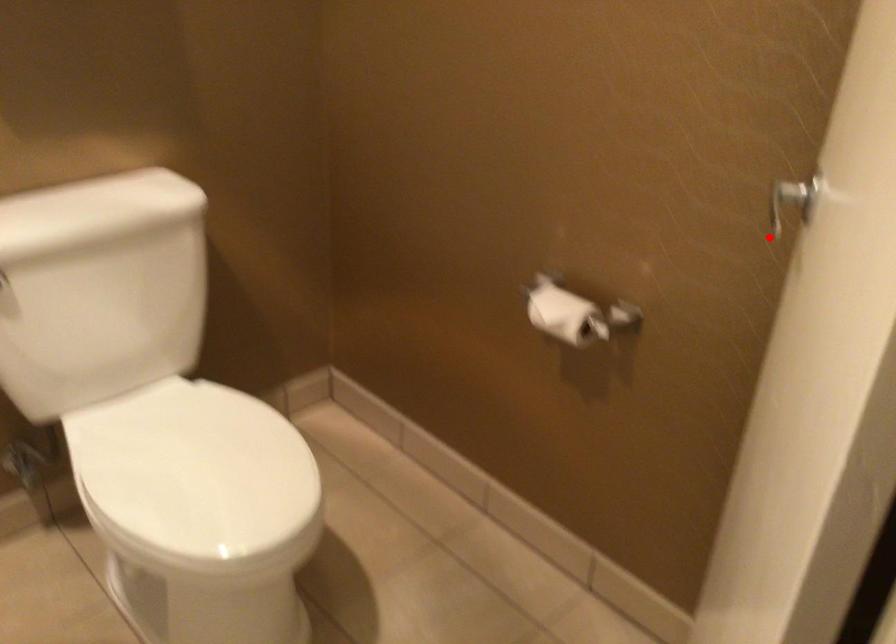
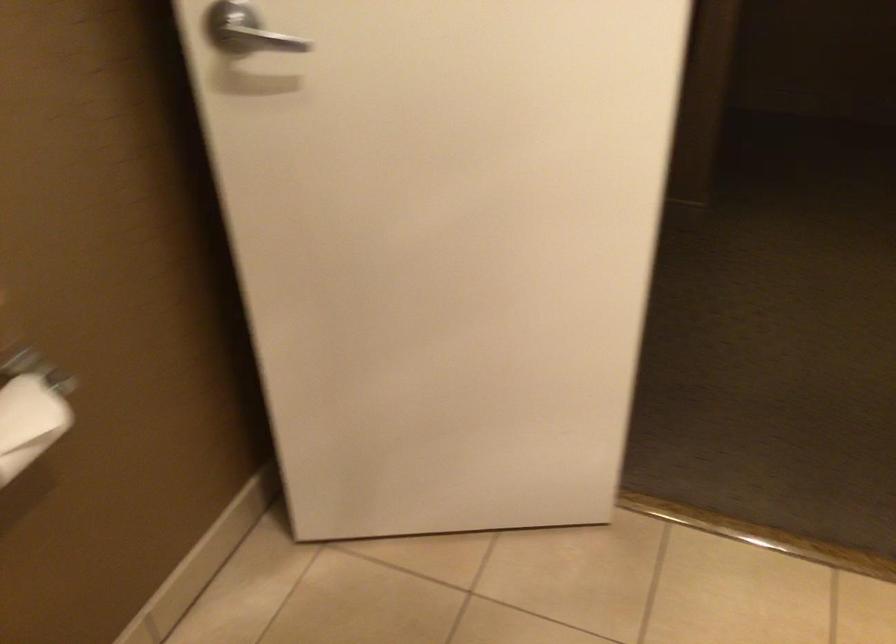
Question: A red point is marked in image1. In image2, is the corresponding 3D point closer to the camera or farther? Reply with the corresponding letter.

Choices:
 (A) The corresponding 3D point is closer.
 (B) The corresponding 3D point is farther.

Answer: (A)